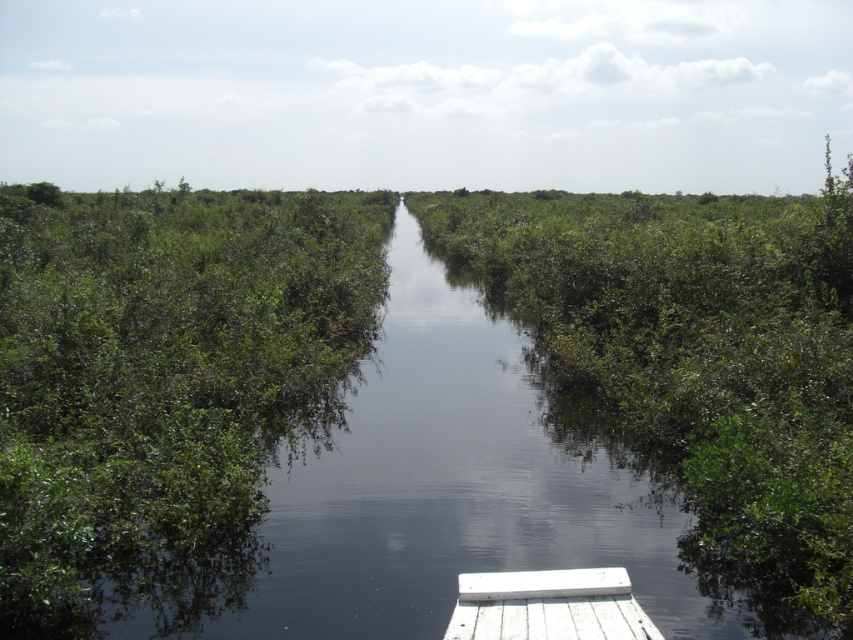
Question: Which point is farther to the camera?

Choices:
 (A) (534, 573)
 (B) (338, 307)
 (C) (734, 294)

Answer: (B)

Question: Which point is closer to the camera?

Choices:
 (A) green leafy river at center
 (B) white weathered wood dock at lower center
 (C) green leafy shrubs at left

Answer: (B)

Question: Can you confirm if green leafy river at center is thinner than white weathered wood dock at lower center?

Choices:
 (A) no
 (B) yes

Answer: (A)

Question: Is green leafy shrubs at left to the left of white weathered wood dock at lower center from the viewer's perspective?

Choices:
 (A) yes
 (B) no

Answer: (A)

Question: Which point appears closest to the camera in this image?

Choices:
 (A) pyautogui.click(x=747, y=440)
 (B) pyautogui.click(x=556, y=573)

Answer: (B)

Question: Where is green leafy river at center located in relation to green leafy shrubs at left in the image?

Choices:
 (A) right
 (B) left

Answer: (A)